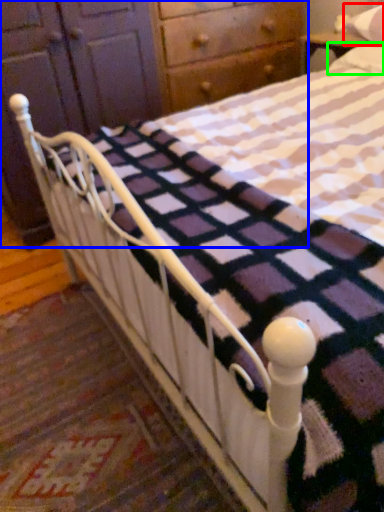
Question: Based on their relative distances, which object is nearer to pillow (highlighted by a red box)? Choose from dresser (highlighted by a blue box) and pillow (highlighted by a green box).

Choices:
 (A) dresser
 (B) pillow

Answer: (B)